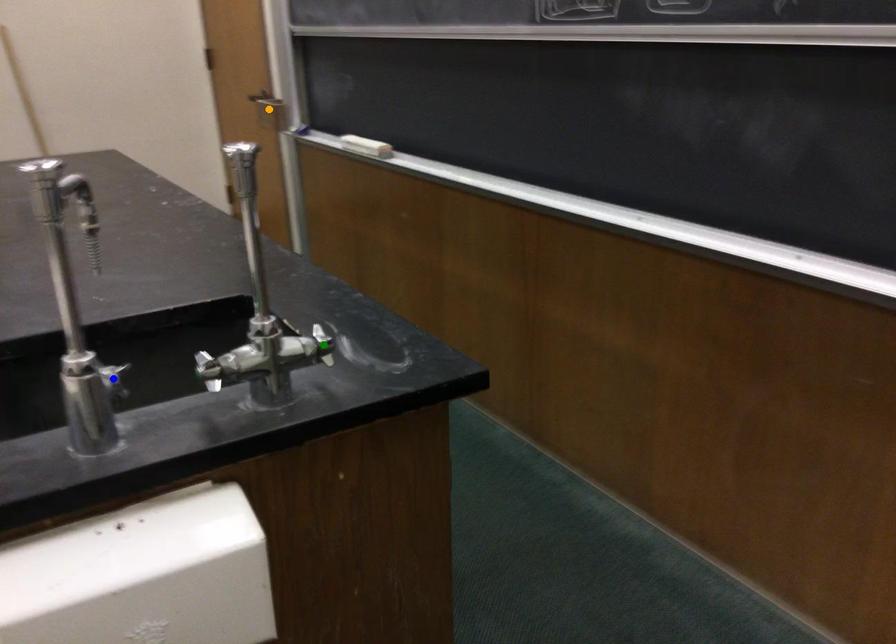
Order these from nearest to farthest:
orange point
blue point
green point

blue point, green point, orange point